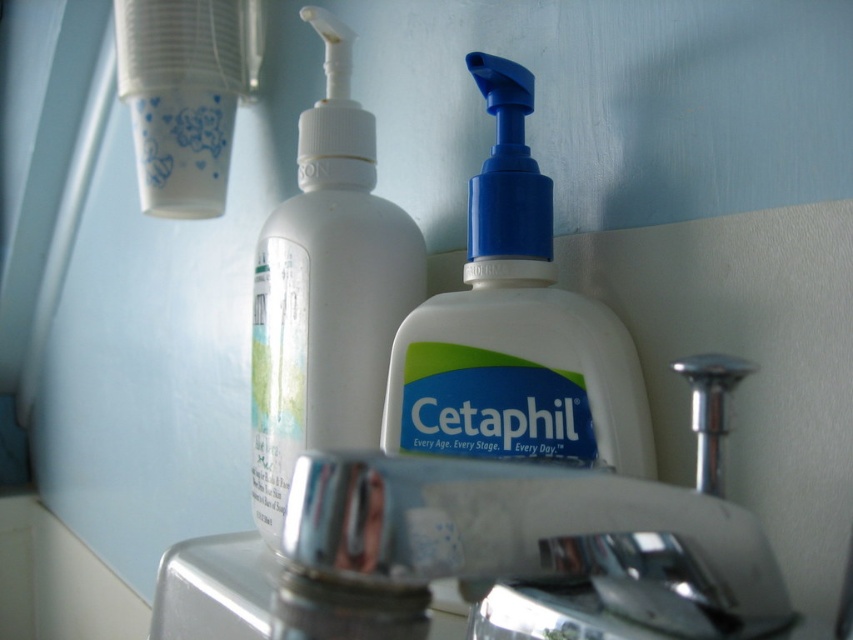
Question: Which point is closer to the camera taking this photo?

Choices:
 (A) (645, 410)
 (B) (345, 182)
 (C) (317, 564)

Answer: (C)

Question: Considering the relative positions of silver metallic faucet at center and white plastic bottle at center in the image provided, where is silver metallic faucet at center located with respect to white plastic bottle at center?

Choices:
 (A) above
 (B) below

Answer: (B)

Question: Which of the following is the closest to the observer?

Choices:
 (A) (715, 614)
 (B) (421, 298)
 (C) (619, 337)

Answer: (A)

Question: Which point is closer to the camera?

Choices:
 (A) (323, 454)
 (B) (323, 264)

Answer: (A)

Question: Is silver metallic faucet at center thinner than white plastic bottle at center?

Choices:
 (A) no
 (B) yes

Answer: (A)

Question: Is silver metallic faucet at center behind white plastic bottle at center?

Choices:
 (A) yes
 (B) no

Answer: (B)